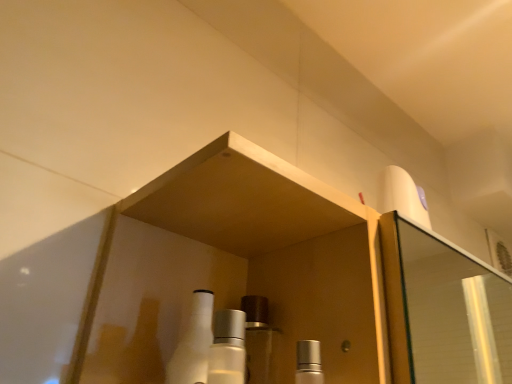
Question: In terms of height, does white glossy bottle at center look taller or shorter compared to satin silver cap at center, positioned as the 2th mouthwash in left-to-right order?

Choices:
 (A) tall
 (B) short

Answer: (A)

Question: Is white glossy bottle at center spatially inside satin silver cap at center, positioned as the 2th mouthwash in left-to-right order, or outside of it?

Choices:
 (A) outside
 (B) inside

Answer: (A)

Question: Estimate the real-world distances between objects in this image. Which object is farther from the white glossy bottle at center?

Choices:
 (A) satin silver bottle at center, the first mouthwash in the left-to-right sequence
 (B) satin silver cap at center, which is the 1th mouthwash in right-to-left order

Answer: (B)

Question: Considering the real-world distances, which object is closest to the satin silver bottle at center, the 2th mouthwash from the right?

Choices:
 (A) white glossy bottle at center
 (B) satin silver cap at center, which is the 1th mouthwash in right-to-left order

Answer: (A)